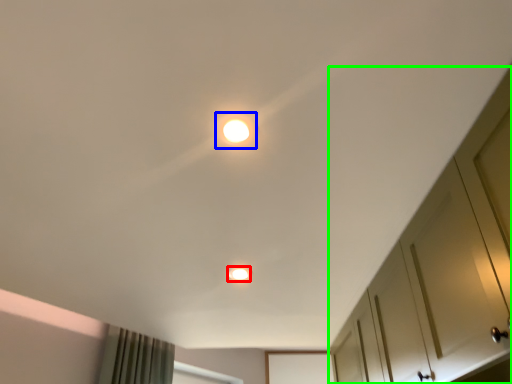
Question: Based on their relative distances, which object is nearer to dot (highlighted by a red box)? Choose from dot (highlighted by a blue box) and dresser (highlighted by a green box).

Choices:
 (A) dot
 (B) dresser

Answer: (B)